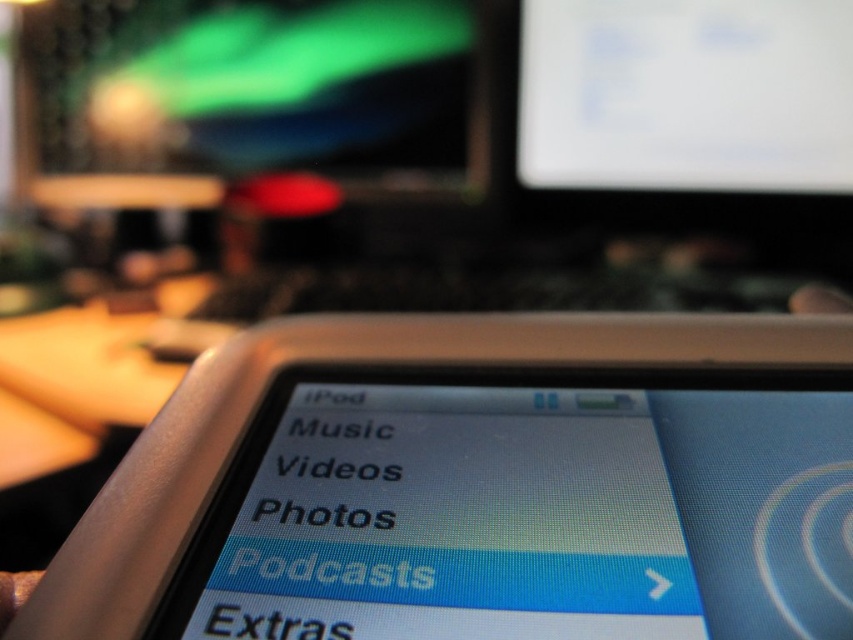
Is green matte monitor at upper left taller than white glossy monitor at upper center?

Incorrect, green matte monitor at upper left's height is not larger of white glossy monitor at upper center's.

Is point (312, 125) less distant than point (570, 54)?

No.

Identify the location of green matte monitor at upper left. This screenshot has height=640, width=853. (248, 84).